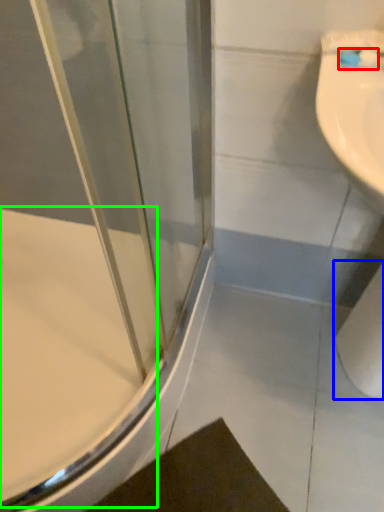
Question: Which object is the farthest from toothbrush (highlighted by a red box)? Choose among these: toilet paper (highlighted by a blue box) or bath (highlighted by a green box).

Choices:
 (A) toilet paper
 (B) bath

Answer: (B)